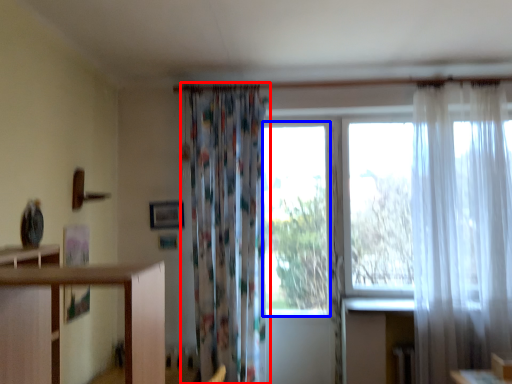
Question: Which of the following is the farthest to the observer, curtain (highlighted by a red box) or window (highlighted by a blue box)?

Choices:
 (A) curtain
 (B) window

Answer: (B)